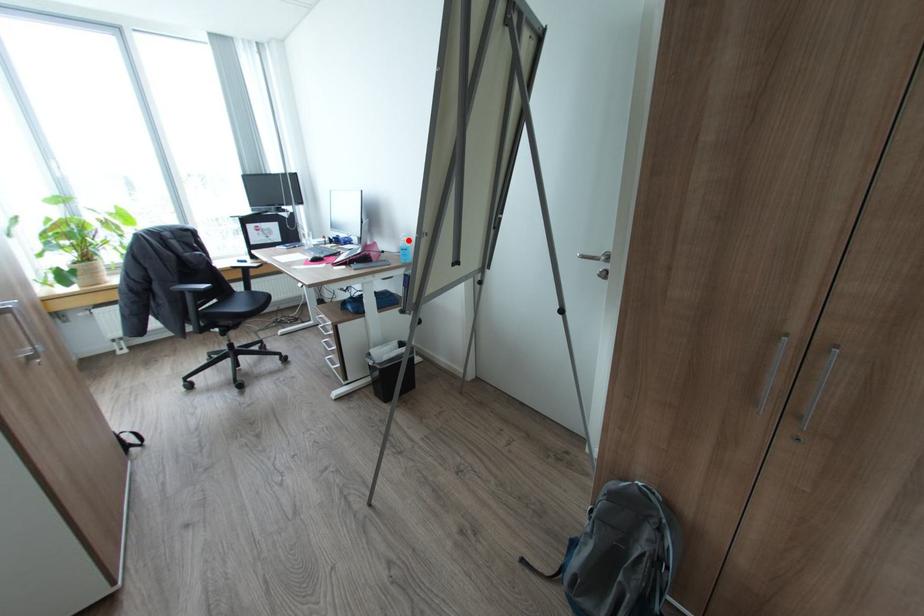
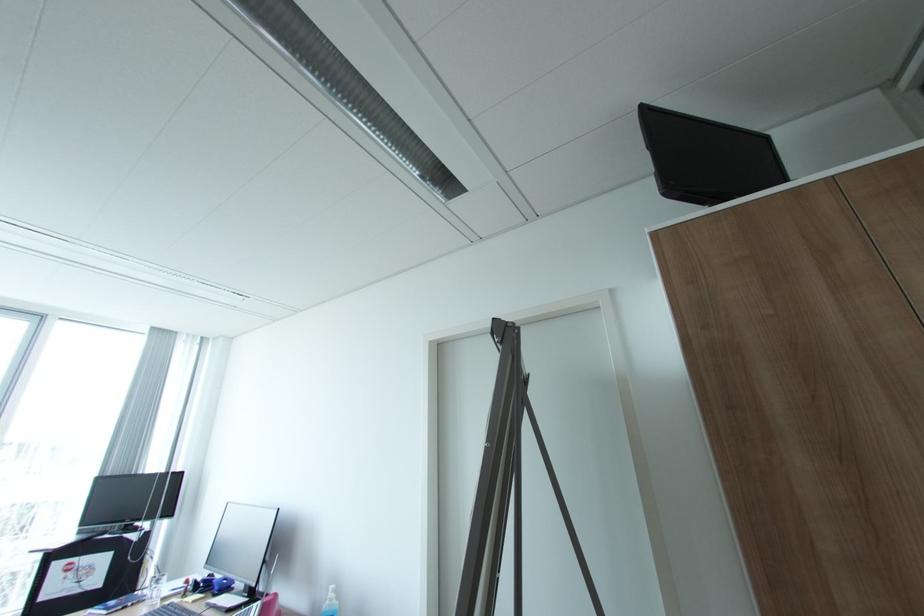
The point at the highlighted location is marked in the first image. Where is the corresponding point in the second image?

(336, 599)